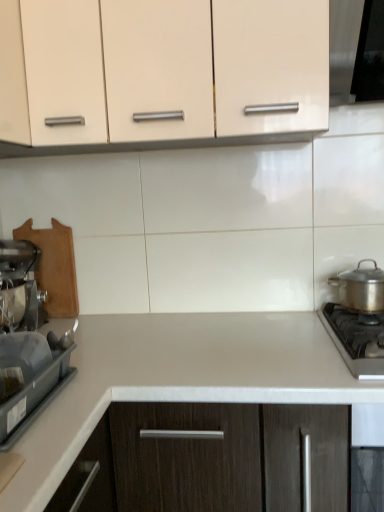
Question: Would you say white laminate countertop at center is to the left or to the right of matte cream cabinet at upper center in the picture?

Choices:
 (A) left
 (B) right

Answer: (B)

Question: Based on their sizes in the image, would you say white laminate countertop at center is bigger or smaller than matte cream cabinet at upper center?

Choices:
 (A) small
 (B) big

Answer: (B)

Question: Estimate the real-world distances between objects in this image. Which object is closer to the stainless steel gas stove at lower right?

Choices:
 (A) white laminate countertop at center
 (B) matte cream cabinet at upper center
 (C) satin silver pot at right, the 1th kitchen appliance positioned from the right
 (D) metallic silver mixer at left, the first kitchen appliance when ordered from left to right

Answer: (C)

Question: Estimate the real-world distances between objects in this image. Which object is closer to the white laminate countertop at center?

Choices:
 (A) stainless steel gas stove at lower right
 (B) satin silver pot at right, the 1th kitchen appliance positioned from the right
 (C) matte cream cabinet at upper center
 (D) metallic silver mixer at left, the first kitchen appliance when ordered from left to right

Answer: (A)